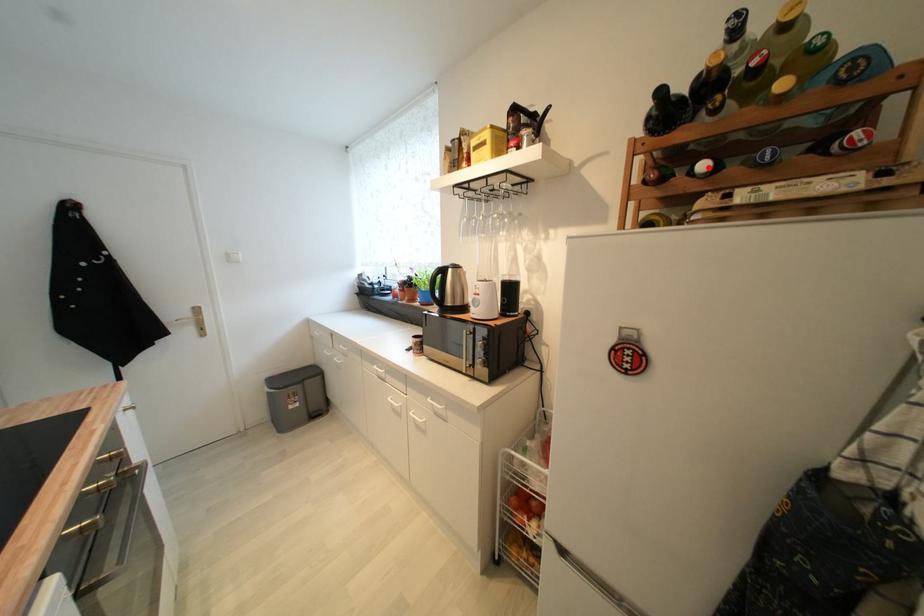
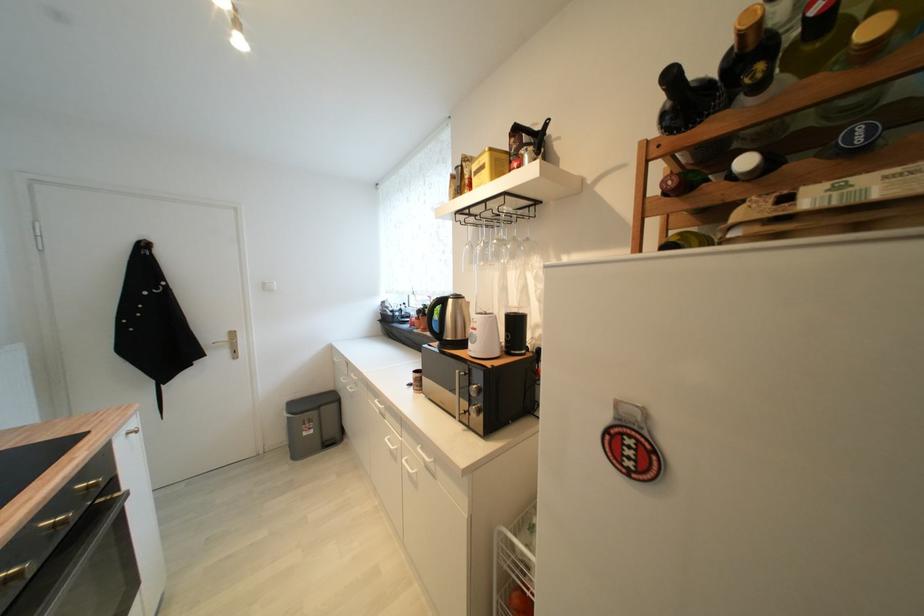
The point at the highlighted location is marked in the first image. Where is the corresponding point in the second image?

(751, 164)